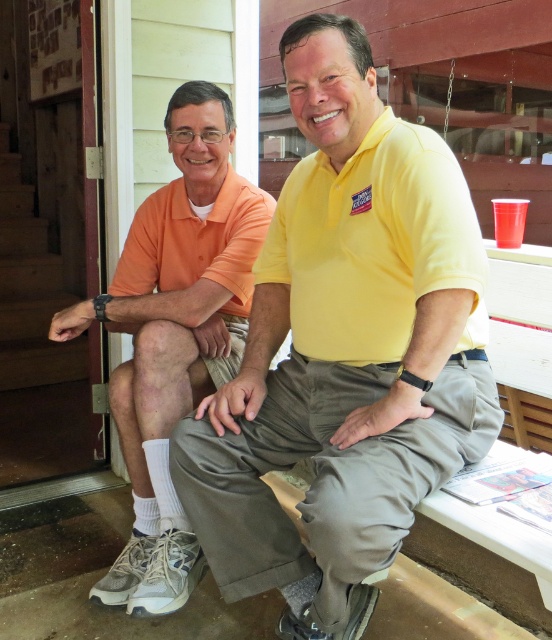
Is yellow matte shirt at center shorter than orange cotton shirt at left?

Yes.

Locate an element on the screen. Image resolution: width=552 pixels, height=640 pixels. yellow matte shirt at center is located at coordinates (345, 353).